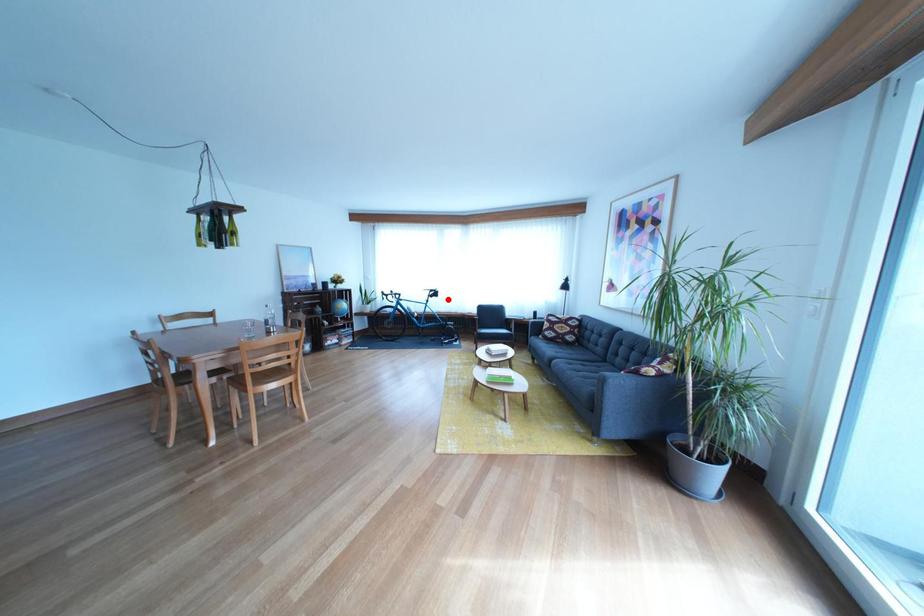
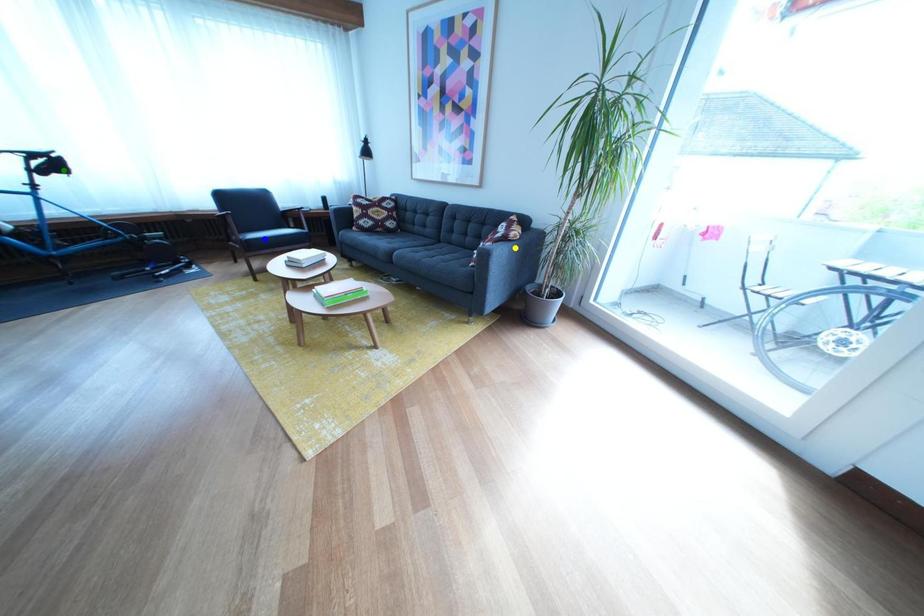
Question: I am providing you with two images of the same scene from different viewpoints. A red point is marked on the first image. You are given multiple points on the second image. Which point in image 2 represents the same 3d spot as the red point in image 1?

Choices:
 (A) green point
 (B) yellow point
 (C) blue point

Answer: (A)